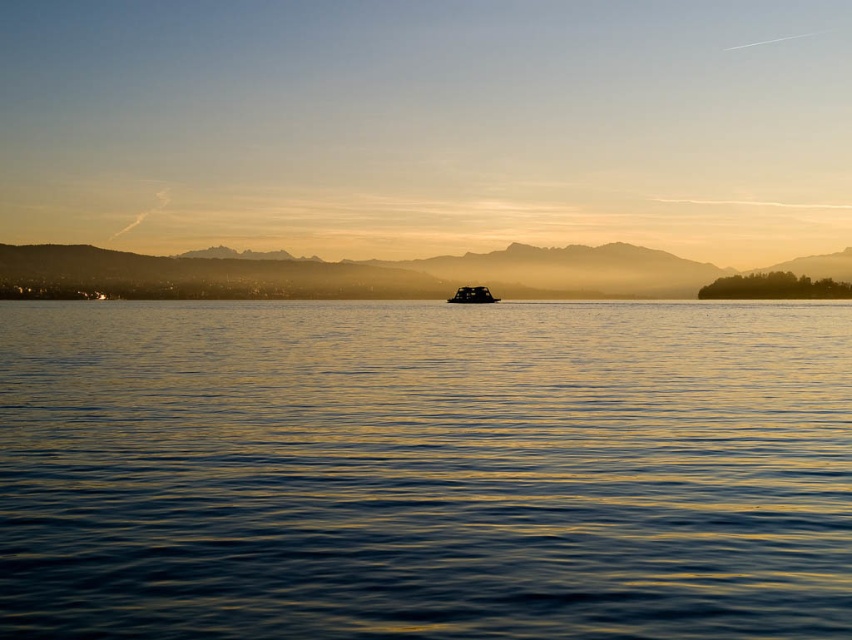
Where is `silvery metallic mountain at center`? The width and height of the screenshot is (852, 640). silvery metallic mountain at center is located at coordinates (403, 275).

Who is more forward, (309,461) or (479,298)?

Point (309,461) is in front.

Which is below, blue water at center or black rubber boat at center?

blue water at center is below.

Is point (3, 628) closer to camera compared to point (459, 298)?

Yes, point (3, 628) is in front of point (459, 298).

Locate an element on the screen. The height and width of the screenshot is (640, 852). blue water at center is located at coordinates (426, 468).

Which is above, blue water at center or silvery metallic mountain at center?

Positioned higher is silvery metallic mountain at center.

Can you confirm if blue water at center is positioned to the left of silvery metallic mountain at center?

In fact, blue water at center is to the right of silvery metallic mountain at center.

Is point (338, 566) more distant than point (711, 269)?

That is False.

Find the location of `blue water at center`. blue water at center is located at coordinates (426, 468).